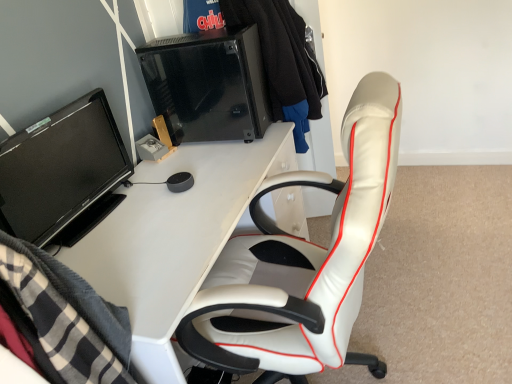
Where is `free area in between black glossy monitor at left and black glass desktop computer at upper center`? free area in between black glossy monitor at left and black glass desktop computer at upper center is located at coordinates (177, 171).